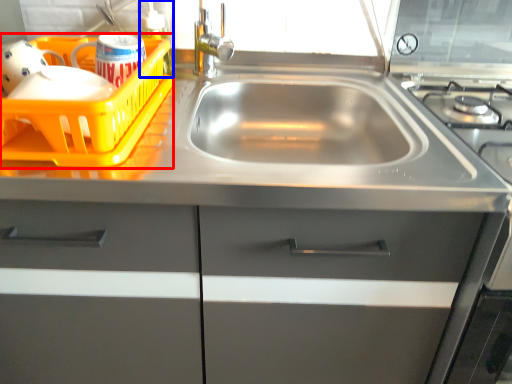
Question: Which object appears closest to the camera in this image, basket (highlighted by a red box) or bottle (highlighted by a blue box)?

Choices:
 (A) basket
 (B) bottle

Answer: (A)